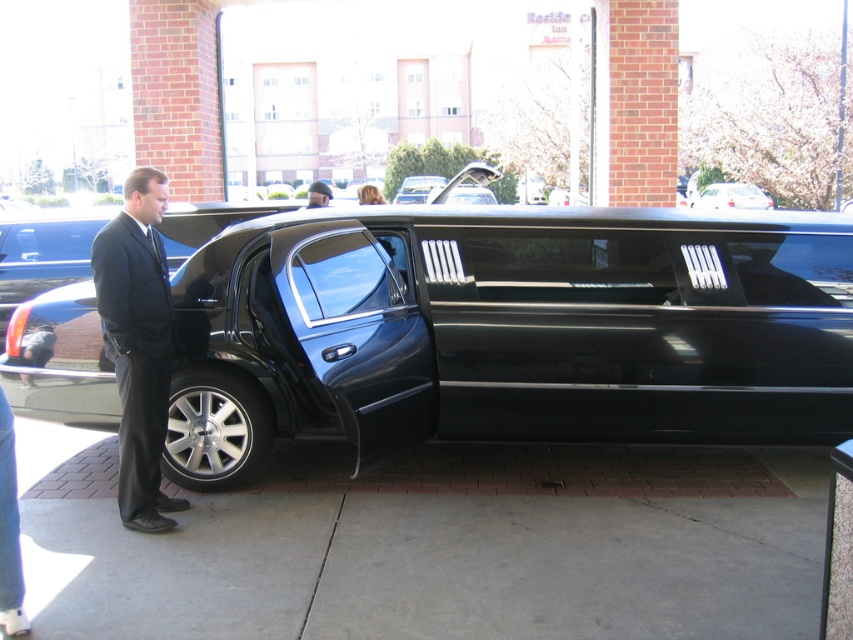
Is matte black suit at center below dark blue suit at center?

Indeed, matte black suit at center is positioned under dark blue suit at center.

Does matte black suit at center have a smaller size compared to dark blue suit at center?

Correct, matte black suit at center occupies less space than dark blue suit at center.

You are a GUI agent. You are given a task and a screenshot of the screen. Output one action in this format:
    pyautogui.click(x=<x>, y=<y>)
    Task: Click on the matte black suit at center
    
    Given the screenshot: What is the action you would take?
    pyautogui.click(x=138, y=342)

Find the location of a particular element. This screenshot has width=853, height=640. matte black suit at center is located at coordinates (138, 342).

Looking at this image, does black glossy limousine at center have a greater width compared to matte black suit at center?

Yes.

Is black glossy limousine at center smaller than matte black suit at center?

No, black glossy limousine at center is not smaller than matte black suit at center.

Who is more forward, (436, 230) or (125, 442)?

Positioned in front is point (125, 442).

This screenshot has height=640, width=853. I want to click on black glossy limousine at center, so click(x=508, y=332).

Does matte black suit at center appear over metallic silver sedan at center?

No, matte black suit at center is not above metallic silver sedan at center.

Which is more to the right, matte black suit at center or metallic silver sedan at center?

Positioned to the right is metallic silver sedan at center.

Locate an element on the screen. matte black suit at center is located at coordinates click(138, 342).

Locate an element on the screen. The image size is (853, 640). matte black suit at center is located at coordinates (138, 342).